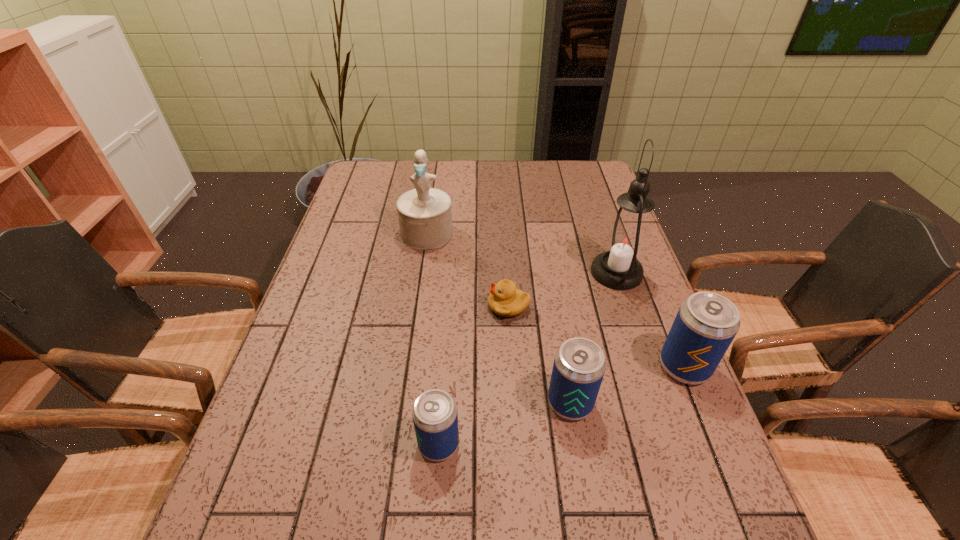
Given the evenly spaced beer cans in the image, where should an extra beer can be added on the left to preserve the spacing? Please point to a vacant space. Please provide its 2D coordinates. Your answer should be formatted as a tuple, i.e. [(x, y)], where the tuple contains the x and y coordinates of a point satisfying the conditions above.

[(286, 492)]